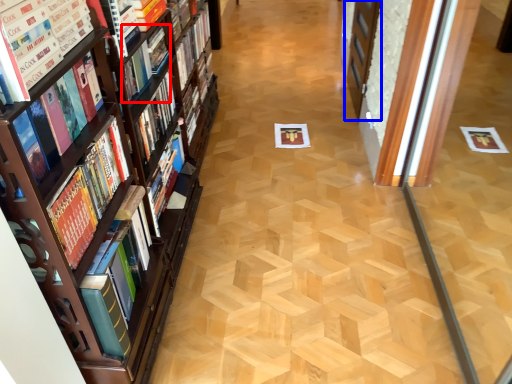
Question: Which point is closer to the camera, book (highlighted by a red box) or screen door (highlighted by a blue box)?

Choices:
 (A) book
 (B) screen door

Answer: (A)